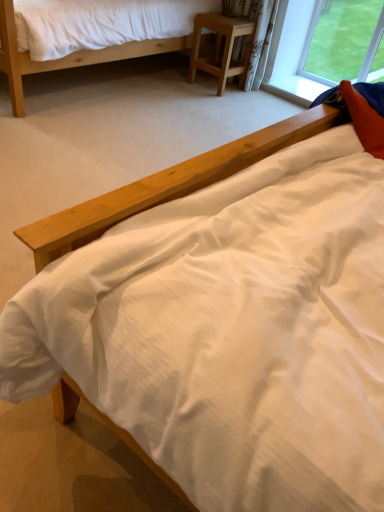
Where is `light brown wood at center`? light brown wood at center is located at coordinates (224, 47).

What do you see at coordinates (224, 47) in the screenshot? I see `light brown wood at center` at bounding box center [224, 47].

The height and width of the screenshot is (512, 384). Describe the element at coordinates (67, 55) in the screenshot. I see `matte wood bed at upper left` at that location.

The height and width of the screenshot is (512, 384). Identify the location of matte wood bed at upper left. (67, 55).

Where is `light brown wood at center`? light brown wood at center is located at coordinates (224, 47).

Which is more to the right, light brown wood at center or matte wood bed at upper left?

light brown wood at center.

Looking at this image, in the image, is light brown wood at center positioned in front of or behind matte wood bed at upper left?

light brown wood at center is behind matte wood bed at upper left.

Considering the points (222, 27) and (129, 49), which point is behind, point (222, 27) or point (129, 49)?

Positioned behind is point (222, 27).

From the image's perspective, which is below, light brown wood at center or matte wood bed at upper left?

light brown wood at center, from the image's perspective.

From a real-world perspective, is light brown wood at center positioned above or below matte wood bed at upper left?

light brown wood at center is situated lower than matte wood bed at upper left in the real world.

Which of these two, light brown wood at center or matte wood bed at upper left, is wider?

With larger width is matte wood bed at upper left.

Between light brown wood at center and matte wood bed at upper left, which one has less height?

light brown wood at center.

Who is bigger, light brown wood at center or matte wood bed at upper left?

Bigger between the two is matte wood bed at upper left.

Is light brown wood at center completely or partially outside of matte wood bed at upper left?

Absolutely, light brown wood at center is external to matte wood bed at upper left.

Would you consider light brown wood at center to be distant from matte wood bed at upper left?

No, light brown wood at center is in close proximity to matte wood bed at upper left.

Is matte wood bed at upper left at the back of light brown wood at center?

No, light brown wood at center is not facing away from matte wood bed at upper left.

Based on the photo, how different are the orientations of light brown wood at center and matte wood bed at upper left in degrees?

They differ by 89.3 degrees in their facing directions.

Image resolution: width=384 pixels, height=512 pixels. In order to click on bed in front of the light brown wood at center in this screenshot , I will do `click(67, 55)`.

Visually, is matte wood bed at upper left positioned to the left or to the right of light brown wood at center?

matte wood bed at upper left is positioned on light brown wood at center's left side.

Considering the positions of objects matte wood bed at upper left and light brown wood at center in the image provided, who is behind, matte wood bed at upper left or light brown wood at center?

light brown wood at center.

Considering the points (18, 82) and (206, 60), which point is in front, point (18, 82) or point (206, 60)?

Positioned in front is point (18, 82).

From the image's perspective, who appears lower, matte wood bed at upper left or light brown wood at center?

light brown wood at center, from the image's perspective.

From a real-world perspective, is matte wood bed at upper left positioned above or below light brown wood at center?

matte wood bed at upper left is situated higher than light brown wood at center in the real world.

Does matte wood bed at upper left have a greater width compared to light brown wood at center?

Yes.

Considering the sizes of objects matte wood bed at upper left and light brown wood at center in the image provided, who is taller, matte wood bed at upper left or light brown wood at center?

With more height is matte wood bed at upper left.

Does matte wood bed at upper left have a smaller size compared to light brown wood at center?

Incorrect, matte wood bed at upper left is not smaller in size than light brown wood at center.

Is matte wood bed at upper left outside of light brown wood at center?

Indeed, matte wood bed at upper left is completely outside light brown wood at center.

Would you say matte wood bed at upper left is a long distance from light brown wood at center?

matte wood bed at upper left is actually quite close to light brown wood at center.

Is matte wood bed at upper left aimed at light brown wood at center?

Yes, matte wood bed at upper left faces towards light brown wood at center.

Identify the location of nightstand located behind the matte wood bed at upper left. (x=224, y=47).

What are the coordinates of `bed above the light brown wood at center (from a real-world perspective)` in the screenshot? It's located at (67, 55).

Where is `bed on the left of light brown wood at center`? The width and height of the screenshot is (384, 512). bed on the left of light brown wood at center is located at coordinates (67, 55).